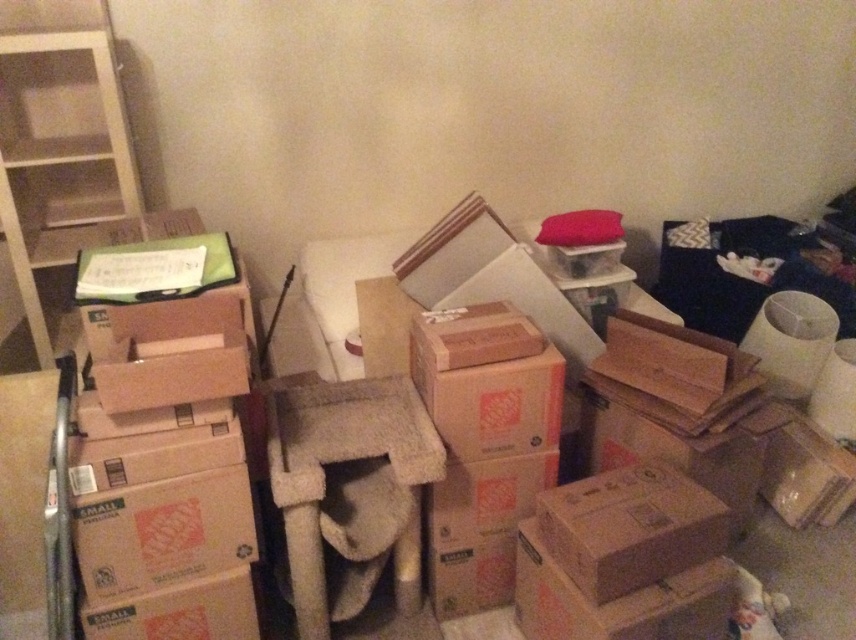
Is point (204, 472) closer to camera compared to point (36, 36)?

Yes, it is in front of point (36, 36).

How far apart are brown cardboard box at left and white wood bookshelf at upper left?

The distance of brown cardboard box at left from white wood bookshelf at upper left is 24.87 inches.

Which is in front, point (164, 276) or point (45, 230)?

Point (164, 276)

Where is `brown cardboard box at left`? This screenshot has width=856, height=640. brown cardboard box at left is located at coordinates (163, 444).